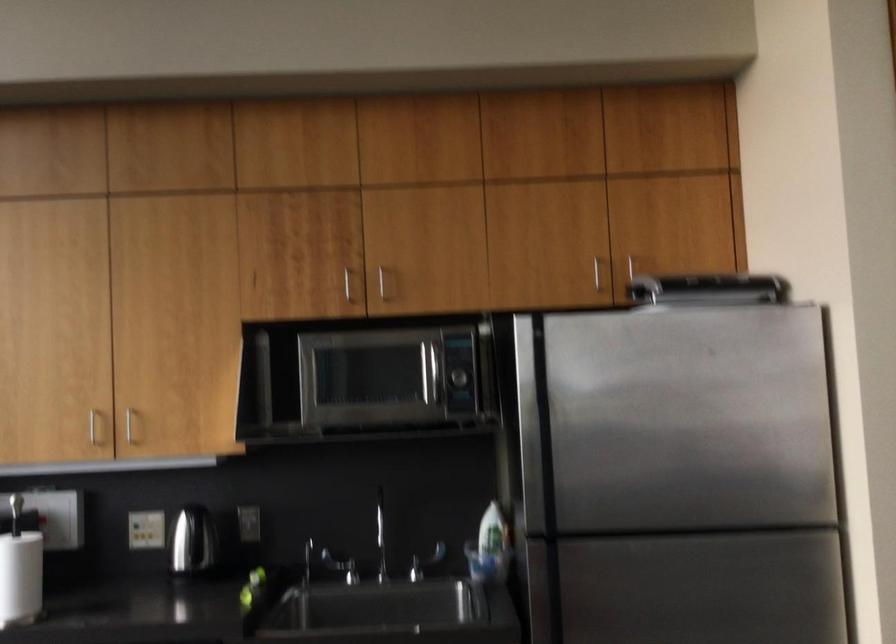
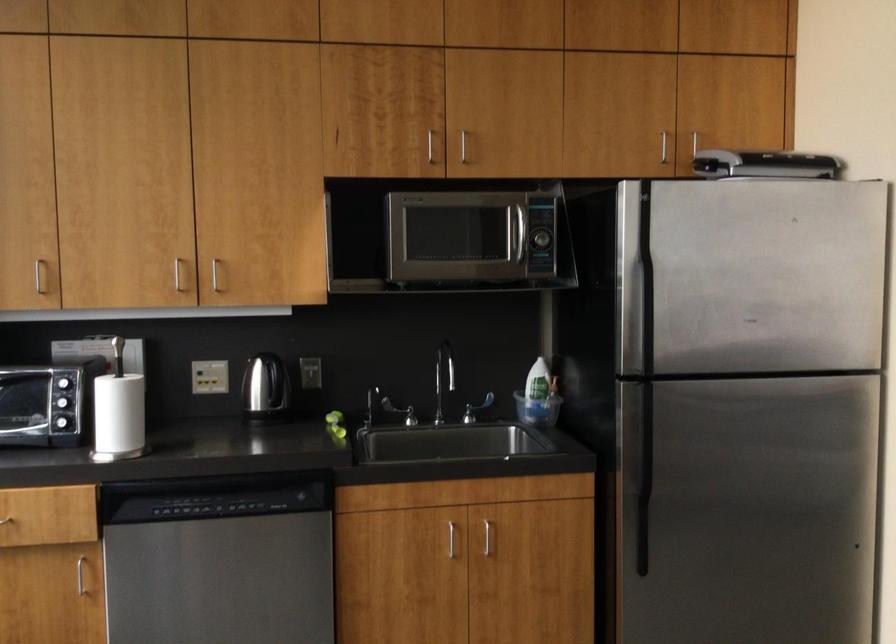
The point at [191,543] is marked in the first image. Where is the corresponding point in the second image?

(266, 391)